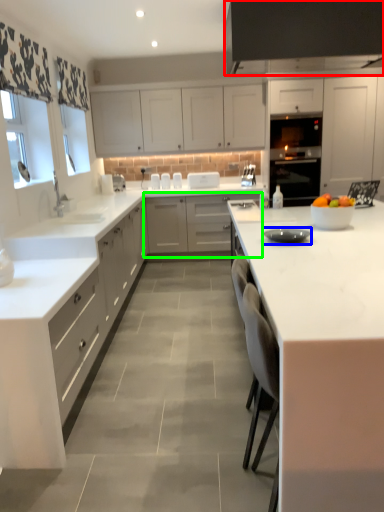
Question: Based on their relative distances, which object is farther from exhaust hood (highlighted by a red box)? Choose from appliance (highlighted by a blue box) and cabinetry (highlighted by a green box).

Choices:
 (A) appliance
 (B) cabinetry

Answer: (B)